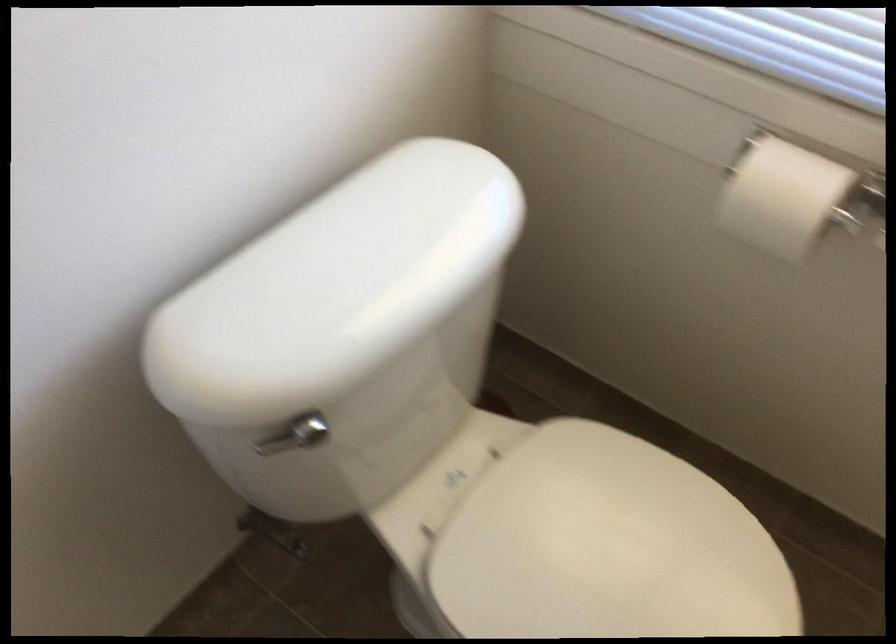
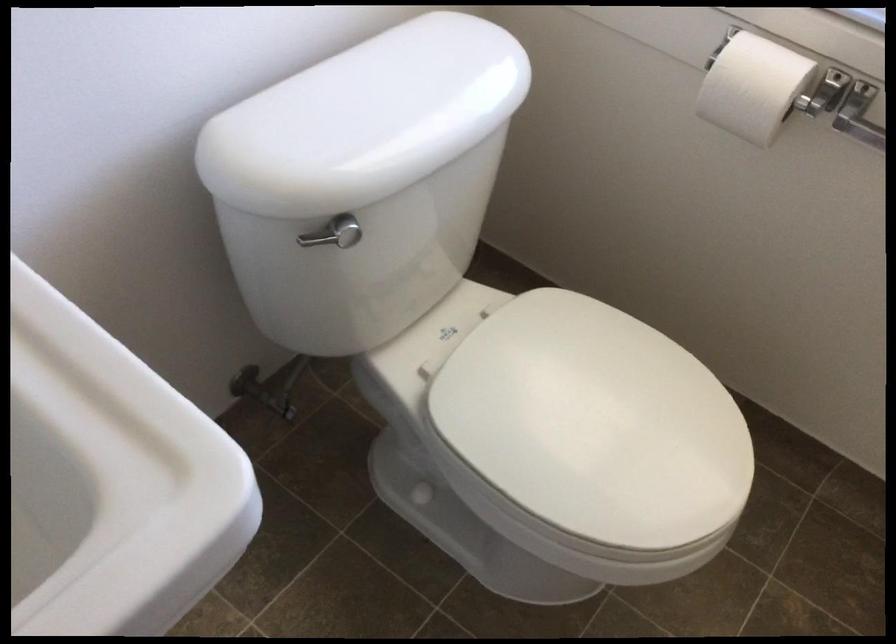
Find the pixel in the second image that matches the point at 297,545 in the first image.

(285, 408)